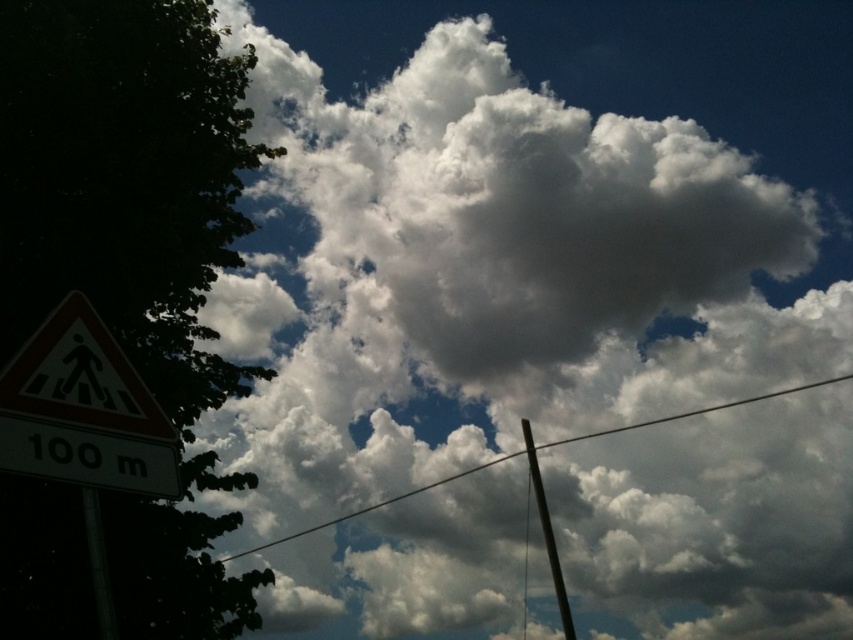
Question: Which object is closer to the camera taking this photo?

Choices:
 (A) white plastic pedestrian sign at lower left
 (B) metallic pole at center
 (C) green leafy tree at left
 (D) white wire at center

Answer: (A)

Question: Among these points, which one is farthest from the camera?

Choices:
 (A) (119, 470)
 (B) (256, 552)
 (C) (149, 36)
 (D) (554, 548)

Answer: (B)

Question: Among these points, which one is nearest to the camera?

Choices:
 (A) (35, 378)
 (B) (10, 163)

Answer: (A)

Question: Does white plastic pedestrian sign at lower left appear on the right side of metallic pole at center?

Choices:
 (A) yes
 (B) no

Answer: (B)

Question: Is green leafy tree at left positioned at the back of white plastic pedestrian sign at lower left?

Choices:
 (A) no
 (B) yes

Answer: (B)

Question: Does white wire at center have a lesser width compared to metallic pole at center?

Choices:
 (A) yes
 (B) no

Answer: (B)